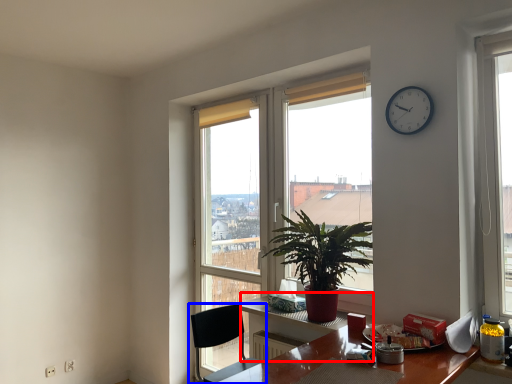
Question: Which of the following is the closest to the observer, computer desk (highlighted by a red box) or chair (highlighted by a blue box)?

Choices:
 (A) computer desk
 (B) chair

Answer: (B)